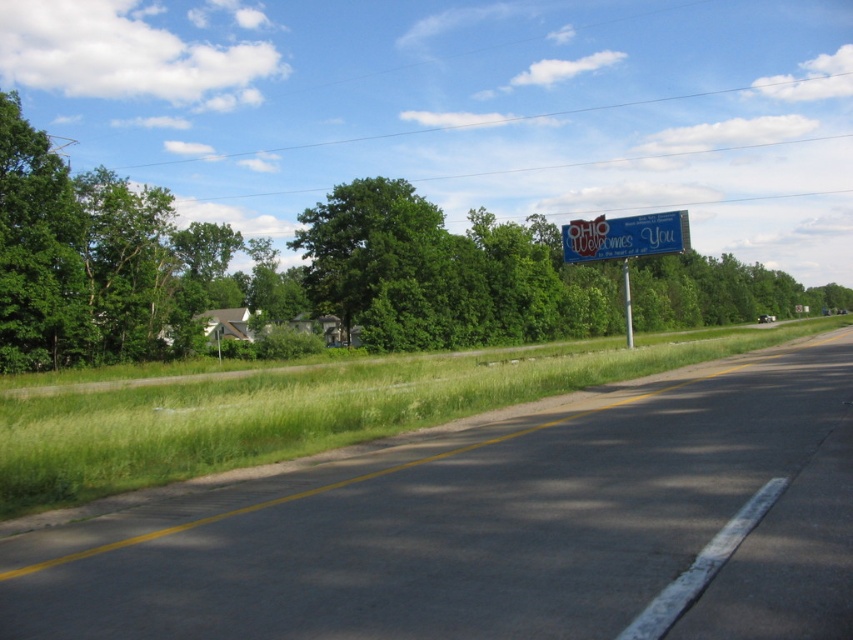
Question: Does green leafy tree at upper center have a larger size compared to blue painted metal sign at right?

Choices:
 (A) no
 (B) yes

Answer: (B)

Question: Is blue painted metal sign at right positioned behind metallic pole at right?

Choices:
 (A) no
 (B) yes

Answer: (B)

Question: Which point is closer to the camera taking this photo?

Choices:
 (A) (624, 266)
 (B) (607, 243)

Answer: (A)

Question: Can you confirm if asphalt road at center is wider than green leafy tree at upper center?

Choices:
 (A) yes
 (B) no

Answer: (B)

Question: Which object appears closest to the camera in this image?

Choices:
 (A) metallic pole at right
 (B) blue painted metal sign at right
 (C) asphalt road at center
 (D) green leafy tree at upper center

Answer: (C)

Question: Which point appears farthest from the camera in this image?

Choices:
 (A) (596, 221)
 (B) (413, 196)

Answer: (B)